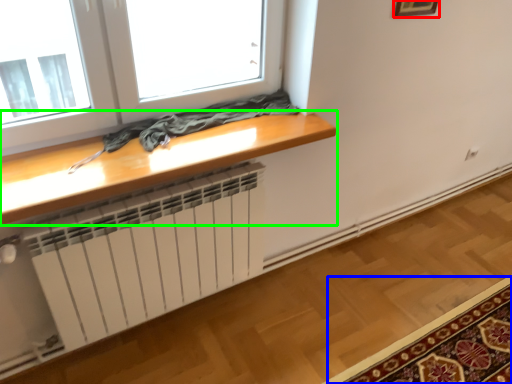
Question: Considering the real-world distances, which object is farthest from picture frame (highlighted by a red box)? mat (highlighted by a blue box) or table (highlighted by a green box)?

Choices:
 (A) mat
 (B) table

Answer: (A)